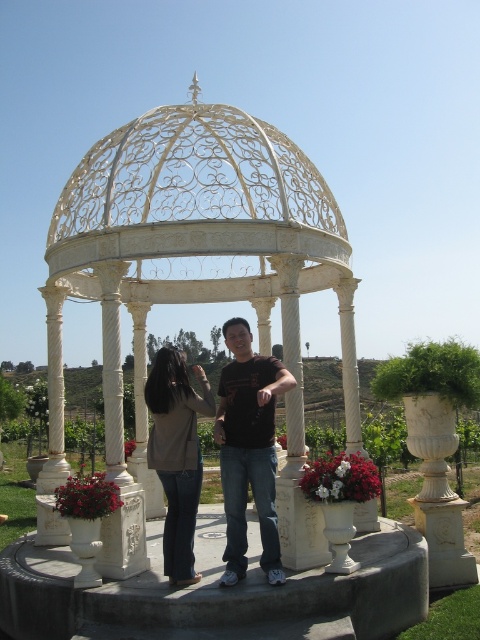
You are planning to place a new bench in the gazebo. The bench you have is 1.5 meters wide. Based on the scene, will the bench fit comfortably within the white marble gazebo at center without overcrowding it, considering the space occupied by the matte beige jacket at center?

The white marble gazebo at center is wider than the matte beige jacket at center. Since the gazebo is wider, there should be enough space to place the 1.5 meter bench comfortably without overcrowding, especially if positioned away from the jacket.